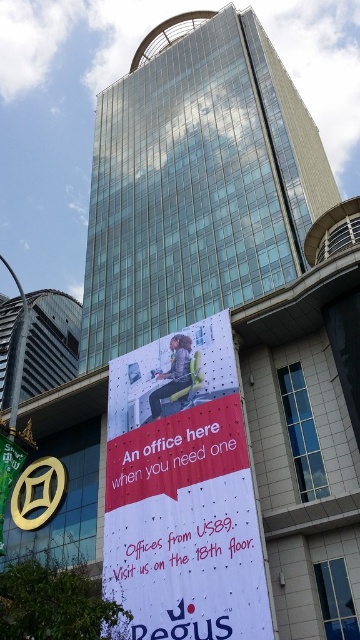
Question: Is white paper banner at center positioned in front of smooth metallic pole at left?

Choices:
 (A) no
 (B) yes

Answer: (B)

Question: Which is nearer to the glassy skyscraper at upper left?

Choices:
 (A) smooth metallic pole at left
 (B) glassy steel building at center

Answer: (A)

Question: Does white paper banner at center have a larger size compared to smooth metallic pole at left?

Choices:
 (A) yes
 (B) no

Answer: (B)

Question: Is glassy steel building at center bigger than white paper banner at center?

Choices:
 (A) yes
 (B) no

Answer: (A)

Question: Estimate the real-world distances between objects in this image. Which object is closer to the glassy steel building at center?

Choices:
 (A) smooth metallic pole at left
 (B) glassy skyscraper at upper left
 (C) white paper banner at center

Answer: (C)

Question: Which of the following is the closest to the observer?

Choices:
 (A) (25, 300)
 (B) (245, 483)
 (C) (38, 364)

Answer: (B)